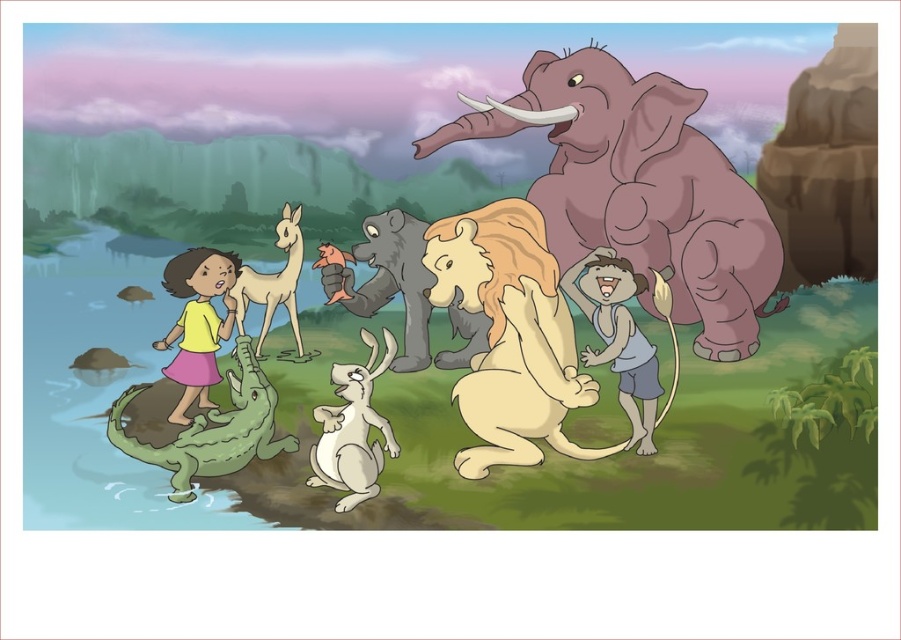
Question: Among these points, which one is nearest to the camera?

Choices:
 (A) (205, 289)
 (B) (522, 93)
 (C) (590, 396)

Answer: (C)

Question: Which of these objects is positioned farthest from the light brown skin at center?

Choices:
 (A) light brown fur lion at center
 (B) yellow matte shirt at center
 (C) gray matte elephant at upper right

Answer: (B)

Question: Can you confirm if light brown fur lion at center is positioned below light brown skin at center?

Choices:
 (A) no
 (B) yes

Answer: (A)

Question: Can you confirm if gray matte elephant at upper right is positioned to the right of light brown fur lion at center?

Choices:
 (A) yes
 (B) no

Answer: (A)

Question: Which point is closer to the camera?

Choices:
 (A) (569, 72)
 (B) (576, 294)
 (C) (472, 445)
 (D) (235, 260)

Answer: (A)

Question: Observing the image, what is the correct spatial positioning of gray matte elephant at upper right in reference to yellow matte shirt at center?

Choices:
 (A) left
 (B) right

Answer: (B)